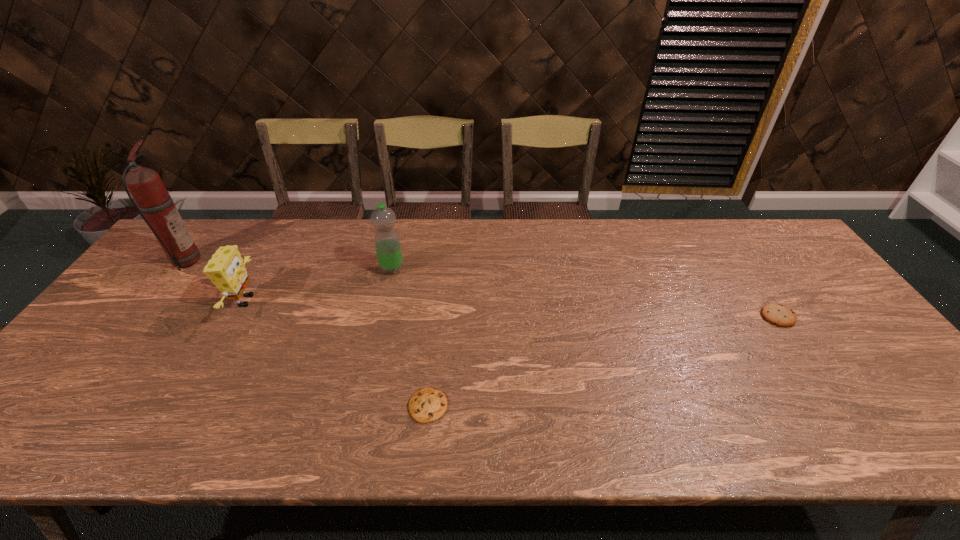
Locate an element on the screen. free space that satisfies the following two spatial constraints: 1. on the side of the shorter cookie with the label and nozzle; 2. on the left side of the tallest object is located at coordinates (72, 406).

The width and height of the screenshot is (960, 540). I want to click on vacant area in the image that satisfies the following two spatial constraints: 1. on the face of the sponge; 2. on the right side of the left cookie, so click(186, 406).

The height and width of the screenshot is (540, 960). Find the location of `vacant space that satisfies the following two spatial constraints: 1. on the side of the fire extinguisher with the label and nozzle; 2. on the left side of the taller cookie`. vacant space that satisfies the following two spatial constraints: 1. on the side of the fire extinguisher with the label and nozzle; 2. on the left side of the taller cookie is located at coordinates (141, 316).

Where is `vacant space that satisfies the following two spatial constraints: 1. on the back side of the taller cookie; 2. on the right side of the nearer cookie`? vacant space that satisfies the following two spatial constraints: 1. on the back side of the taller cookie; 2. on the right side of the nearer cookie is located at coordinates (437, 316).

Identify the location of blank area in the image that satisfies the following two spatial constraints: 1. on the back side of the fourth tallest object; 2. on the side of the leftmost object with the label and nozzle. Image resolution: width=960 pixels, height=540 pixels. (740, 261).

This screenshot has height=540, width=960. In order to click on free space in the image that satisfies the following two spatial constraints: 1. on the back side of the rightmost object; 2. on the side of the tallest object with the label and nozzle in this screenshot , I will do `click(740, 261)`.

This screenshot has width=960, height=540. What are the coordinates of `free location that satisfies the following two spatial constraints: 1. on the front side of the water bottle; 2. on the right side of the right cookie` in the screenshot? It's located at (381, 316).